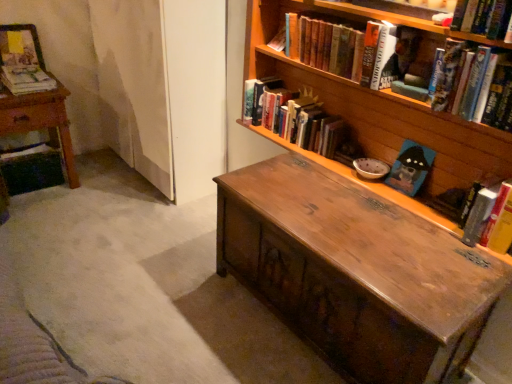
This screenshot has height=384, width=512. What do you see at coordinates (344, 49) in the screenshot?
I see `hardcover book at upper center, the fourth book when ordered from right to left` at bounding box center [344, 49].

Find the location of a particular element. The image size is (512, 384). hardcover book at upper center, the fourth book when ordered from right to left is located at coordinates (344, 49).

What do you see at coordinates (476, 85) in the screenshot? I see `hardcover book at upper right, arranged as the sixth book when viewed from the left` at bounding box center [476, 85].

Based on the photo, how much space does hardcover book at upper right, arranged as the sixth book when viewed from the left, occupy horizontally?

The width of hardcover book at upper right, arranged as the sixth book when viewed from the left, is 6.53 inches.

The image size is (512, 384). What do you see at coordinates (490, 219) in the screenshot?
I see `hardcover book at right, the seventh book in the left-to-right sequence` at bounding box center [490, 219].

Where is `hardcover book at right, which is counted as the first book, starting from the right`? This screenshot has height=384, width=512. hardcover book at right, which is counted as the first book, starting from the right is located at coordinates (490, 219).

This screenshot has height=384, width=512. What do you see at coordinates (410, 168) in the screenshot?
I see `blue matte book at center right, placed as the fifth book when sorted from left to right` at bounding box center [410, 168].

Measure the distance between point (237, 40) and camera.

7.36 feet.

The height and width of the screenshot is (384, 512). What are the coordinates of `hardcover book at upper center, the fourth book when ordered from right to left` in the screenshot? It's located at (344, 49).

From a real-world perspective, between matte paper magazine at upper left, which is counted as the seventh book, starting from the right, and blue matte book at center right, placed as the fifth book when sorted from left to right, who is vertically lower?

blue matte book at center right, placed as the fifth book when sorted from left to right.

Can you confirm if matte paper magazine at upper left, which is counted as the seventh book, starting from the right, is positioned to the left of blue matte book at center right, which is the third book from right to left?

Yes, matte paper magazine at upper left, which is counted as the seventh book, starting from the right, is to the left of blue matte book at center right, which is the third book from right to left.

Looking at the image, does matte paper magazine at upper left, which is counted as the seventh book, starting from the right, seem bigger or smaller compared to blue matte book at center right, which is the third book from right to left?

matte paper magazine at upper left, which is counted as the seventh book, starting from the right, is bigger than blue matte book at center right, which is the third book from right to left.

Considering the sizes of objects wooden table at left and hardcover book at upper right, arranged as the sixth book when viewed from the left, in the image provided, who is wider, wooden table at left or hardcover book at upper right, arranged as the sixth book when viewed from the left,?

wooden table at left.

Which is in front, wooden table at left or hardcover book at upper right, arranged as the sixth book when viewed from the left?

hardcover book at upper right, arranged as the sixth book when viewed from the left, is in front.

At what (x,y) coordinates should I click in order to perform the action: click on table below the hardcover book at upper right, arranged as the sixth book when viewed from the left (from the image's perspective). Please return your answer as a coordinate pair (x, y). This screenshot has width=512, height=384. Looking at the image, I should click on (41, 122).

Is wooden table at left facing away from hardcover book at upper right, arranged as the sixth book when viewed from the left?

No, wooden table at left's orientation is not away from hardcover book at upper right, arranged as the sixth book when viewed from the left.

Consider the image. From a real-world perspective, is wooden bookcase at upper right physically located above or below matte paper magazine at upper left, the 1th book from the left?

wooden bookcase at upper right is above matte paper magazine at upper left, the 1th book from the left.

From the picture: Visually, is wooden bookcase at upper right positioned to the left or to the right of matte paper magazine at upper left, which is counted as the seventh book, starting from the right?

Based on their positions, wooden bookcase at upper right is located to the right of matte paper magazine at upper left, which is counted as the seventh book, starting from the right.

Can matte paper magazine at upper left, the 1th book from the left, be found inside wooden bookcase at upper right?

No, matte paper magazine at upper left, the 1th book from the left, is not surrounded by wooden bookcase at upper right.

From the image's perspective, would you say wooden table at left is shown under blue matte book at center right, which is the third book from right to left?

Result: No.

Where is `the 4th book to the right of the wooden table at left, starting your count from the anchor`? the 4th book to the right of the wooden table at left, starting your count from the anchor is located at coordinates (410, 168).

Does wooden table at left have a larger size compared to blue matte book at center right, which is the third book from right to left?

Yes.

Between hardcover book at right, the seventh book in the left-to-right sequence, and matte paper magazine at upper left, which is counted as the seventh book, starting from the right, which one has larger width?

hardcover book at right, the seventh book in the left-to-right sequence.

Based on the photo, can you confirm if hardcover book at right, which is counted as the first book, starting from the right, is positioned to the left of matte paper magazine at upper left, which is counted as the seventh book, starting from the right?

In fact, hardcover book at right, which is counted as the first book, starting from the right, is to the right of matte paper magazine at upper left, which is counted as the seventh book, starting from the right.

From a real-world perspective, does hardcover book at right, which is counted as the first book, starting from the right, sit lower than matte paper magazine at upper left, which is counted as the seventh book, starting from the right?

Yes.

Do you think hardcover book at upper center, the fourth book when ordered from right to left, is within hardcover book at upper right, which is the second book in right-to-left order, or outside of it?

hardcover book at upper center, the fourth book when ordered from right to left, exists outside the volume of hardcover book at upper right, which is the second book in right-to-left order.

Visually, is hardcover book at upper center, marked as the fourth book in a left-to-right arrangement, positioned to the left or to the right of hardcover book at upper right, arranged as the sixth book when viewed from the left?

Clearly, hardcover book at upper center, marked as the fourth book in a left-to-right arrangement, is on the left of hardcover book at upper right, arranged as the sixth book when viewed from the left, in the image.

Is hardcover book at upper center, marked as the fourth book in a left-to-right arrangement, next to hardcover book at upper right, arranged as the sixth book when viewed from the left?

No, hardcover book at upper center, marked as the fourth book in a left-to-right arrangement, is not beside hardcover book at upper right, arranged as the sixth book when viewed from the left.

Can you tell me how much hardcover book at upper center, the fourth book when ordered from right to left, and hardcover book at upper right, which is the second book in right-to-left order, differ in facing direction?

They differ by 0.00114 degrees in their facing directions.

Does matte paper book at left, which appears as the 2th book when viewed from the left, appear on the left side of hardcover book at center, which is the third book in left-to-right order?

Indeed, matte paper book at left, which appears as the 2th book when viewed from the left, is positioned on the left side of hardcover book at center, which is the third book in left-to-right order.

Which object is closer to the camera, matte paper book at left, which appears as the 2th book when viewed from the left, or hardcover book at center, which is the third book in left-to-right order?

Positioned in front is hardcover book at center, which is the third book in left-to-right order.

Based on the photo, what's the angular difference between matte paper book at left, which appears as the 2th book when viewed from the left, and hardcover book at center, placed as the fifth book when sorted from right to left,'s facing directions?

The facing directions of matte paper book at left, which appears as the 2th book when viewed from the left, and hardcover book at center, placed as the fifth book when sorted from right to left, are 86.6 degrees apart.

From a real-world perspective, starting from the matte paper book at left, which appears as the 2th book when viewed from the left, which book is the 1st one below it? Please provide its 2D coordinates.

[(297, 117)]

Identify the location of book that is the 3rd one when counting backward from the blue matte book at center right, which is the third book from right to left. (23, 60).

You are a GUI agent. You are given a task and a screenshot of the screen. Output one action in this format:
    pyautogui.click(x=<x>, y=<y>)
    Task: Click on the 1st book above when counting from the wooden table at left (from the image's perspective)
    The height and width of the screenshot is (384, 512).
    Given the screenshot: What is the action you would take?
    pyautogui.click(x=476, y=85)

Based on their spatial positions, is wooden bookcase at upper right or wooden table at left further from hardcover book at center, placed as the fifth book when sorted from right to left?

Among the two, wooden table at left is located further to hardcover book at center, placed as the fifth book when sorted from right to left.

Considering their positions, is matte paper book at left, the 6th book when ordered from right to left, positioned closer to hardcover book at upper right, which is the second book in right-to-left order, than hardcover book at center, which is the third book in left-to-right order?

hardcover book at center, which is the third book in left-to-right order.

Based on the photo, estimate the real-world distances between objects in this image. Which object is closer to matte paper magazine at upper left, which is counted as the seventh book, starting from the right, matte paper book at left, which appears as the 2th book when viewed from the left, or hardcover book at right, which is counted as the first book, starting from the right?

matte paper book at left, which appears as the 2th book when viewed from the left, lies closer to matte paper magazine at upper left, which is counted as the seventh book, starting from the right, than the other object.

From the image, which object appears to be farther from wooden bookcase at upper right, hardcover book at upper right, which is the second book in right-to-left order, or hardcover book at upper center, marked as the fourth book in a left-to-right arrangement?

The object further to wooden bookcase at upper right is hardcover book at upper right, which is the second book in right-to-left order.

From the image, which object appears to be farther from hardcover book at center, placed as the fifth book when sorted from right to left, matte paper magazine at upper left, the 1th book from the left, or matte paper book at left, the 6th book when ordered from right to left?

Among the two, matte paper magazine at upper left, the 1th book from the left, is located further to hardcover book at center, placed as the fifth book when sorted from right to left.

Considering their positions, is hardcover book at upper center, marked as the fourth book in a left-to-right arrangement, positioned further to wooden bookcase at upper right than hardcover book at center, placed as the fifth book when sorted from right to left?

hardcover book at upper center, marked as the fourth book in a left-to-right arrangement.

When comparing their distances from wooden bookcase at upper right, does hardcover book at upper right, which is the second book in right-to-left order, or blue matte book at center right, placed as the fifth book when sorted from left to right, seem further?

blue matte book at center right, placed as the fifth book when sorted from left to right, is positioned further to the anchor wooden bookcase at upper right.

Looking at the image, which one is located closer to wooden table at left, matte paper magazine at upper left, the 1th book from the left, or hardcover book at upper right, which is the second book in right-to-left order?

Among the two, matte paper magazine at upper left, the 1th book from the left, is located nearer to wooden table at left.

Image resolution: width=512 pixels, height=384 pixels. What are the coordinates of `book between wooden table at left and hardcover book at center, placed as the fifth book when sorted from right to left, in the horizontal direction` in the screenshot? It's located at (27, 80).

Find the location of a particular element. book located between matte paper book at left, the 6th book when ordered from right to left, and hardcover book at upper center, marked as the fourth book in a left-to-right arrangement, in the left-right direction is located at coordinates (297, 117).

I want to click on book between matte paper magazine at upper left, which is counted as the seventh book, starting from the right, and hardcover book at center, which is the third book in left-to-right order, in the horizontal direction, so click(x=27, y=80).

The height and width of the screenshot is (384, 512). In order to click on table between matte paper magazine at upper left, which is counted as the seventh book, starting from the right, and wooden bookcase at upper right from left to right in this screenshot , I will do `click(41, 122)`.